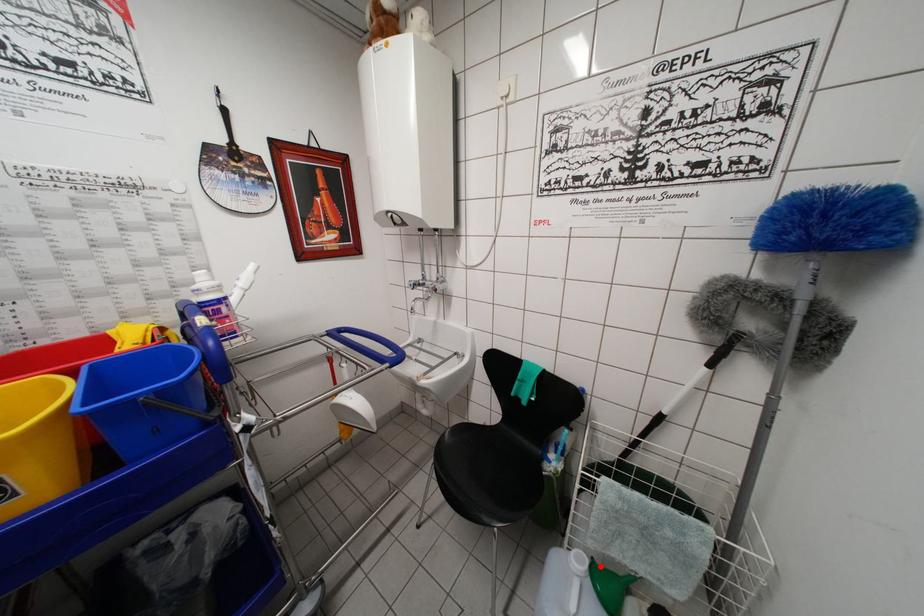
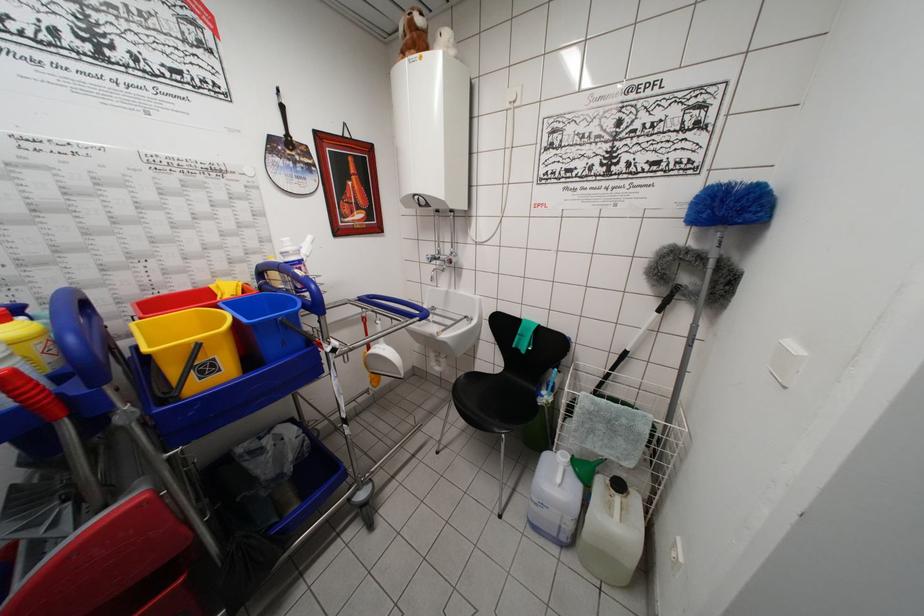
Question: I am providing you with two images of the same scene from different viewpoints. A red point is marked on the first image. At the location where the point appears in image 1, is it still visible in image 2?

Choices:
 (A) Yes
 (B) No

Answer: (A)